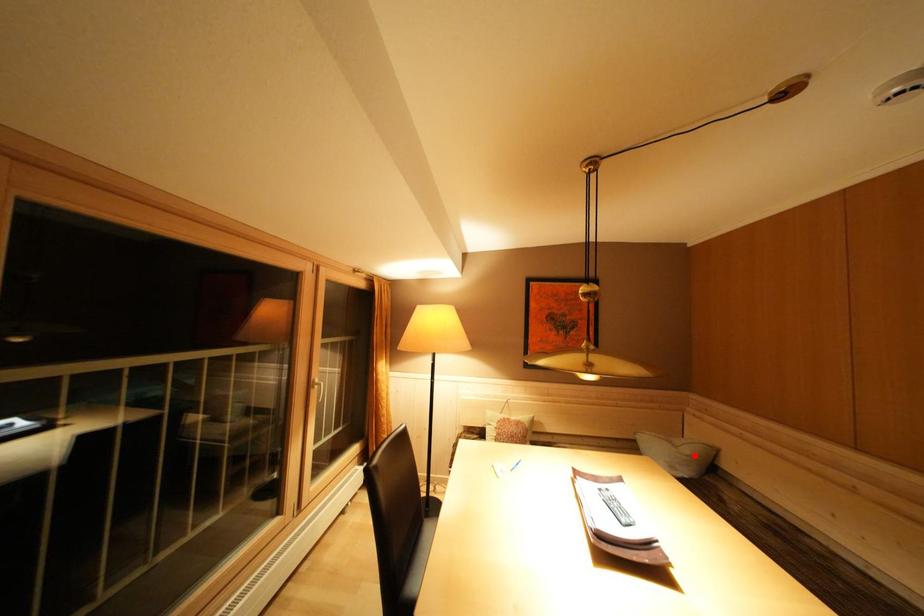
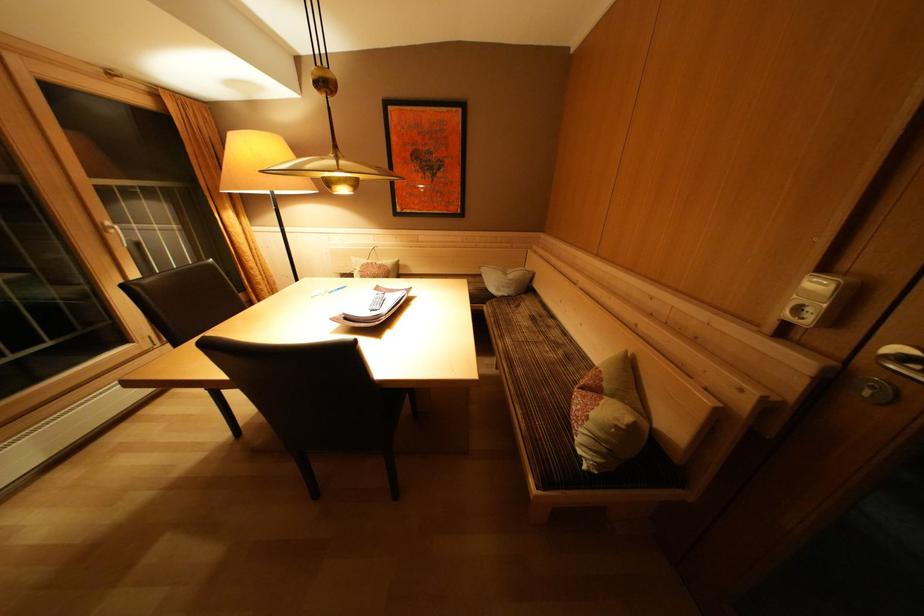
Question: I am providing you with two images of the same scene from different viewpoints. A red point is shown in image1. For the corresponding object point in image2, is it positioned nearer or farther from the camera?

Choices:
 (A) Nearer
 (B) Farther

Answer: (A)